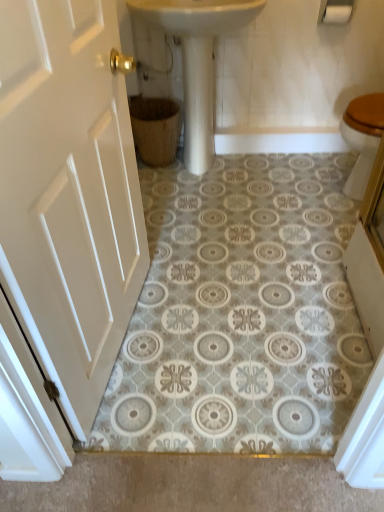
Question: Is woven brown basket at lower center behind white painted wood door at left?

Choices:
 (A) yes
 (B) no

Answer: (A)

Question: Does woven brown basket at lower center have a lesser width compared to white painted wood door at left?

Choices:
 (A) yes
 (B) no

Answer: (B)

Question: Are woven brown basket at lower center and white painted wood door at left making contact?

Choices:
 (A) no
 (B) yes

Answer: (A)

Question: Does woven brown basket at lower center appear on the left side of white painted wood door at left?

Choices:
 (A) yes
 (B) no

Answer: (B)

Question: From a real-world perspective, is woven brown basket at lower center over white painted wood door at left?

Choices:
 (A) no
 (B) yes

Answer: (A)

Question: From the image's perspective, relative to white matte toilet paper at upper right, is white painted wood door at left above or below?

Choices:
 (A) below
 (B) above

Answer: (A)

Question: Considering the positions of point (6, 238) and point (332, 13), is point (6, 238) closer or farther from the camera than point (332, 13)?

Choices:
 (A) farther
 (B) closer

Answer: (B)

Question: Would you say white painted wood door at left is inside or outside white matte toilet paper at upper right?

Choices:
 (A) outside
 (B) inside

Answer: (A)

Question: From their relative heights in the image, would you say white painted wood door at left is taller or shorter than white matte toilet paper at upper right?

Choices:
 (A) short
 (B) tall

Answer: (B)

Question: From a real-world perspective, is white glossy sink at center above or below woven brown basket at lower center?

Choices:
 (A) below
 (B) above

Answer: (B)

Question: Looking at the image, does white glossy sink at center seem bigger or smaller compared to woven brown basket at lower center?

Choices:
 (A) small
 (B) big

Answer: (B)

Question: Does point (208, 124) appear closer or farther from the camera than point (135, 117)?

Choices:
 (A) closer
 (B) farther

Answer: (A)

Question: From the image's perspective, is white glossy sink at center positioned above or below woven brown basket at lower center?

Choices:
 (A) below
 (B) above

Answer: (B)

Question: Would you say white painted wood door at left is to the left or to the right of white glossy sink at center in the picture?

Choices:
 (A) right
 (B) left

Answer: (B)

Question: Considering the positions of white painted wood door at left and white glossy sink at center in the image, is white painted wood door at left taller or shorter than white glossy sink at center?

Choices:
 (A) tall
 (B) short

Answer: (A)